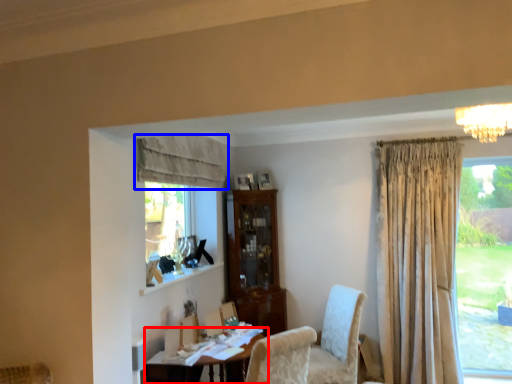
Question: Which of the following is the closest to the observer, table (highlighted by a red box) or curtain (highlighted by a blue box)?

Choices:
 (A) table
 (B) curtain

Answer: (A)